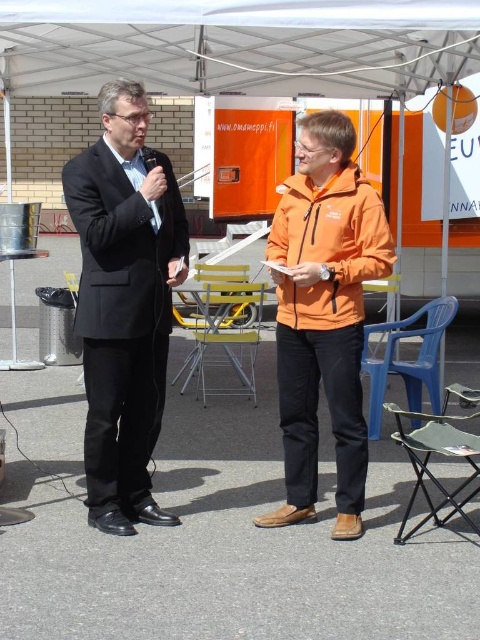
Does point (124, 316) lie in front of point (309, 144)?

No, it is not.

Between point (164, 211) and point (347, 324), which one is positioned behind?

Point (164, 211)

Which is in front, point (98, 163) or point (337, 129)?

Point (337, 129)

Locate an element on the screen. This screenshot has width=480, height=640. matte black suit at left is located at coordinates [124, 304].

What do you see at coordinates (324, 314) in the screenshot? I see `orange matte jacket at center` at bounding box center [324, 314].

Can you confirm if orange matte jacket at center is positioned to the left of orange softshell jacket at center?

No, orange matte jacket at center is not to the left of orange softshell jacket at center.

Between point (356, 492) and point (374, 227), which one is positioned in front?

Positioned in front is point (374, 227).

Locate an element on the screen. The height and width of the screenshot is (640, 480). orange matte jacket at center is located at coordinates (324, 314).

Between matte black suit at left and orange softshell jacket at center, which one has more height?

With more height is matte black suit at left.

Is matte black suit at left further to the viewer compared to orange softshell jacket at center?

No.

Between point (73, 220) and point (381, 216), which one is positioned in front?

Point (73, 220)

Where is `matte black suit at left`? matte black suit at left is located at coordinates [x=124, y=304].